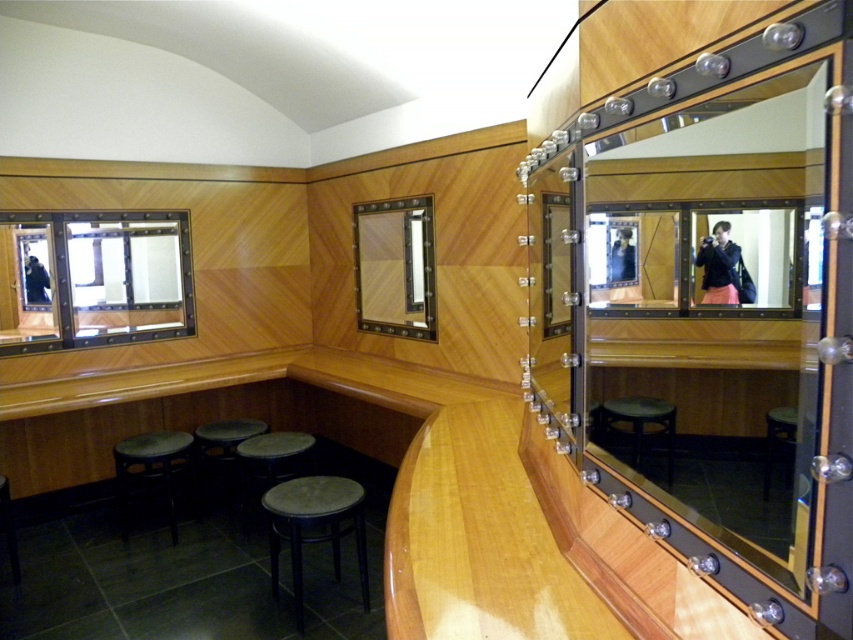
Question: Does dark brown leather stool at center come behind matte black jacket at center?

Choices:
 (A) no
 (B) yes

Answer: (B)

Question: Which point is closer to the camera?

Choices:
 (A) green fabric stool at lower left
 (B) matte black jacket at center
 (C) matte black mirror at left
 (D) dark brown wood stool at lower right

Answer: (D)

Question: Which object appears closest to the camera in this image?

Choices:
 (A) matte black mirror at left
 (B) dark brown leather stool at center

Answer: (B)

Question: Does matte wooden mirror at center come behind dark brown leather stool at center?

Choices:
 (A) yes
 (B) no

Answer: (A)

Question: Is matte black jacket at center bigger than dark brown wooden stool at center?

Choices:
 (A) yes
 (B) no

Answer: (B)

Question: Based on their relative distances, which object is farther from the matte black jacket at center?

Choices:
 (A) dark brown wood stool at lower right
 (B) matte black mirror at left

Answer: (B)